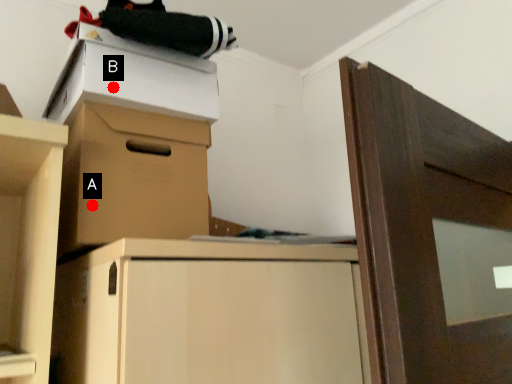
Question: Two points are circled on the image, labeled by A and B beside each circle. Which point is farther to the camera?

Choices:
 (A) A is further
 (B) B is further

Answer: (B)